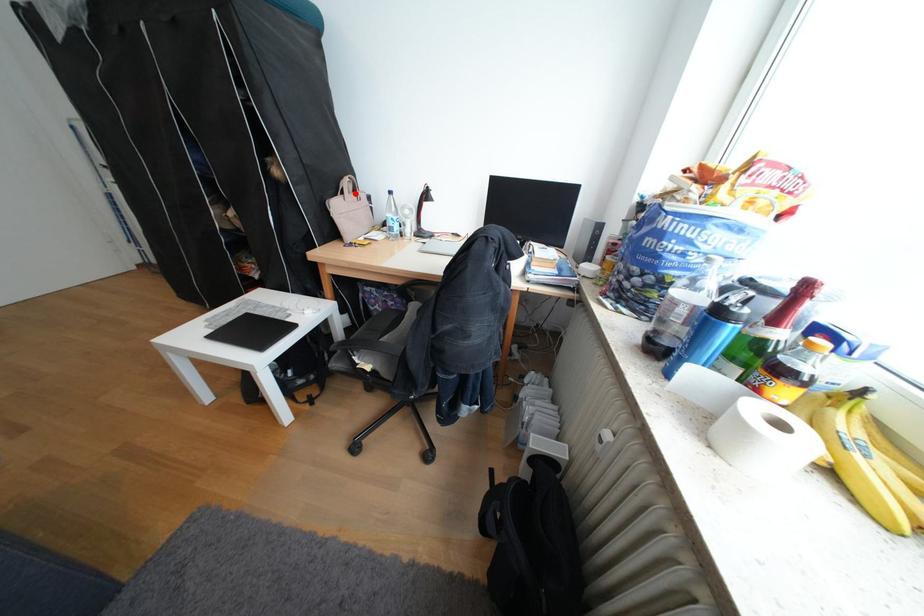
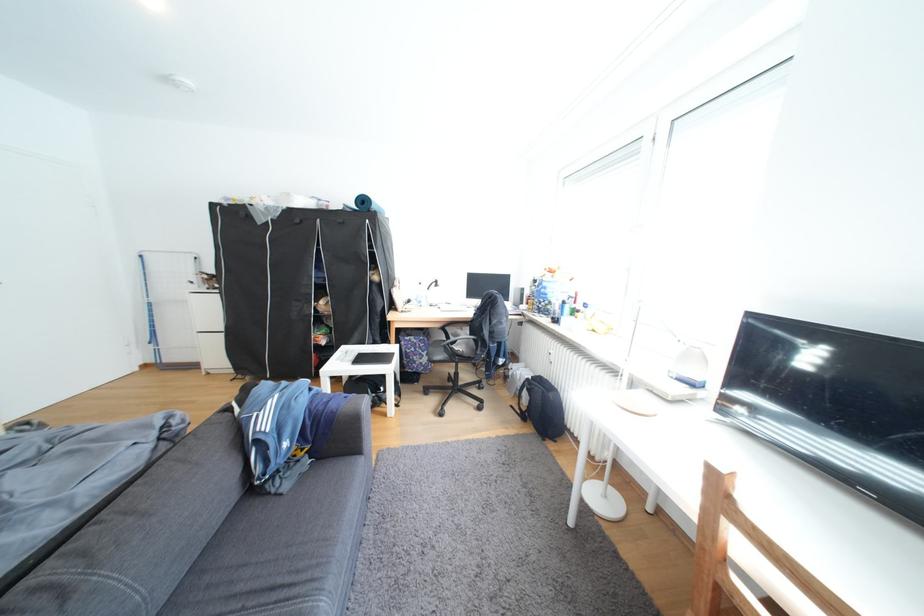
Locate, in the second image, the point that corresponds to the highlighted location in the first image.

(408, 286)